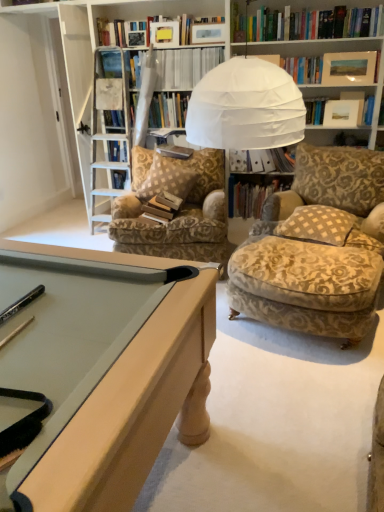
This screenshot has width=384, height=512. Find the location of `free spot in front of velvet beige ottoman at lower right, which is counted as the first chair, starting from the right`. free spot in front of velvet beige ottoman at lower right, which is counted as the first chair, starting from the right is located at coordinates (298, 392).